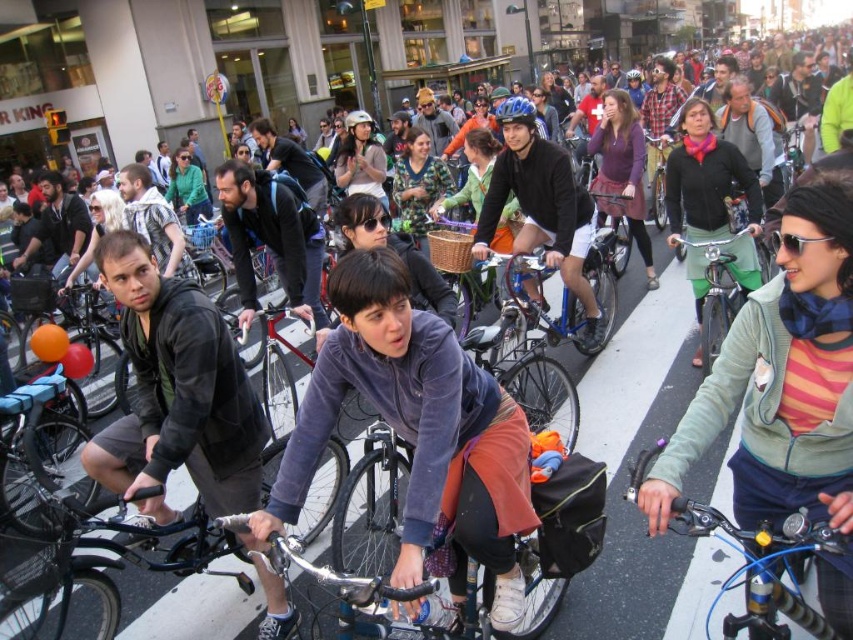
Question: Which of the following is the closest to the observer?

Choices:
 (A) velvet purple sweater at center
 (B) striped jersey at center
 (C) matte purple sweater at center
 (D) green fabric bicycle at center-right

Answer: (B)

Question: Is velvet purple sweater at center to the left of matte blue helmet at center from the viewer's perspective?

Choices:
 (A) yes
 (B) no

Answer: (A)

Question: Which is farther from the metallic blue bicycle at center?

Choices:
 (A) striped jersey at center
 (B) matte blue helmet at center
 (C) matte black helmet at center
 (D) matte purple sweater at center

Answer: (D)

Question: Does velvet purple sweater at center appear on the right side of green fabric skirt at center?

Choices:
 (A) no
 (B) yes

Answer: (A)

Question: Is matte purple sweater at center positioned behind matte blue helmet at center?

Choices:
 (A) yes
 (B) no

Answer: (A)

Question: Among these objects, which one is farthest from the camera?

Choices:
 (A) green fabric skirt at center
 (B) velvet purple sweater at center
 (C) metallic blue bicycle at center

Answer: (A)